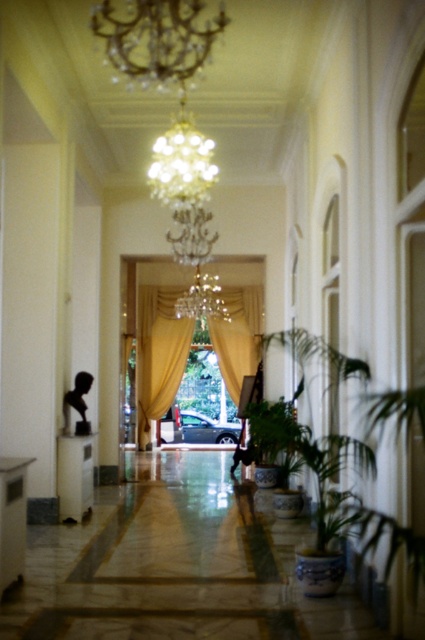
You are standing in the hallway and see two points marked on the floor. The first point is at coordinates point [166,10] and the second is at point [169,346]. Which point is closer to the entrance of the hallway?

Point [166,10] is in front of point [169,346], so it is closer to the entrance of the hallway.

You are an interior designer assessing the hallway. You notice the crystal glass chandelier at upper center and the crystal glass chandelier at center. Which of these two chandeliers has a larger diameter?

The crystal glass chandelier at center has a larger diameter than the crystal glass chandelier at upper center.

You are standing in the hallway and want to take a photo of the point at coordinates (226, 376). If your camera has a focal length of 50mm and you are 15.41 meters away from the point, what is the approximate size of the point in millimeters on the camera sensor?

The point at coordinates (226, 376) is 15.41 meters away from the camera. Using the formula for sensor size calculation, the size can be approximated as focal length multiplied by the subject size divided by distance. However, since the point is a single point, its size on the sensor would depend on the resolution and lens quality, but theoretically, it would be very small, likely less than 1 millimeter.